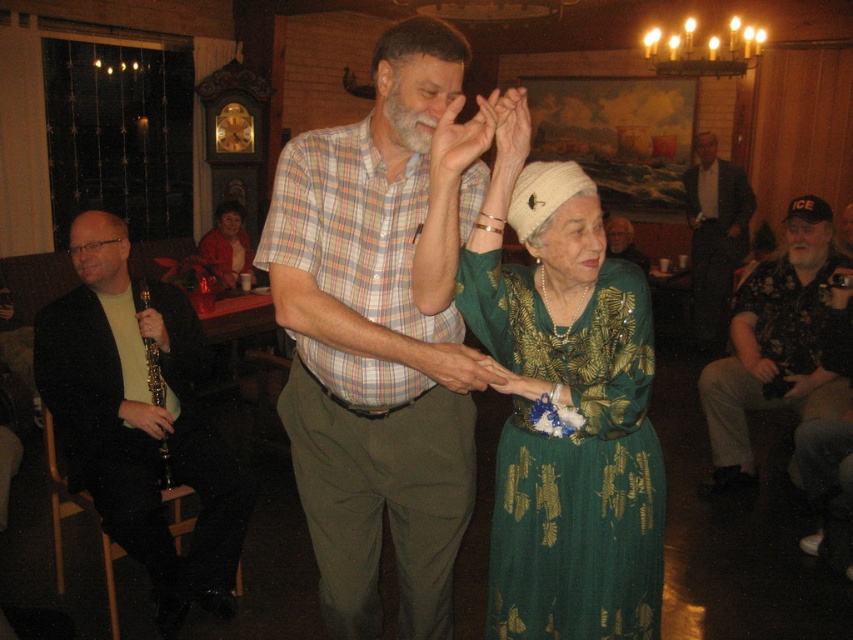
Is green textured dress at center wider than black matte clarinet at left?

Incorrect, green textured dress at center's width does not surpass black matte clarinet at left's.

In the scene shown: Between green textured dress at center and black matte clarinet at left, which one has more height?

With more height is black matte clarinet at left.

Does point (492, 260) come farther from viewer compared to point (85, 481)?

No.

At what (x,y) coordinates should I click in order to perform the action: click on green textured dress at center. Please return your answer as a coordinate pair (x, y). The image size is (853, 640). Looking at the image, I should click on (572, 458).

Does point (688, 221) come farther from viewer compared to point (625, 241)?

Yes, it is.

Can you confirm if dark gray suit at right is bigger than gray hair at center?

Yes.

Is point (746, 220) farther from viewer compared to point (627, 221)?

That is False.

Find the location of a particular element. This screenshot has height=640, width=853. dark gray suit at right is located at coordinates (714, 234).

At what (x,y) coordinates should I click in order to perform the action: click on green textured dress at center. Please return your answer as a coordinate pair (x, y). The image size is (853, 640). Looking at the image, I should click on (572, 458).

Which is in front, point (514, 324) or point (619, 244)?

Point (514, 324)

The image size is (853, 640). I want to click on green textured dress at center, so click(x=572, y=458).

Identify the location of green textured dress at center. (572, 458).